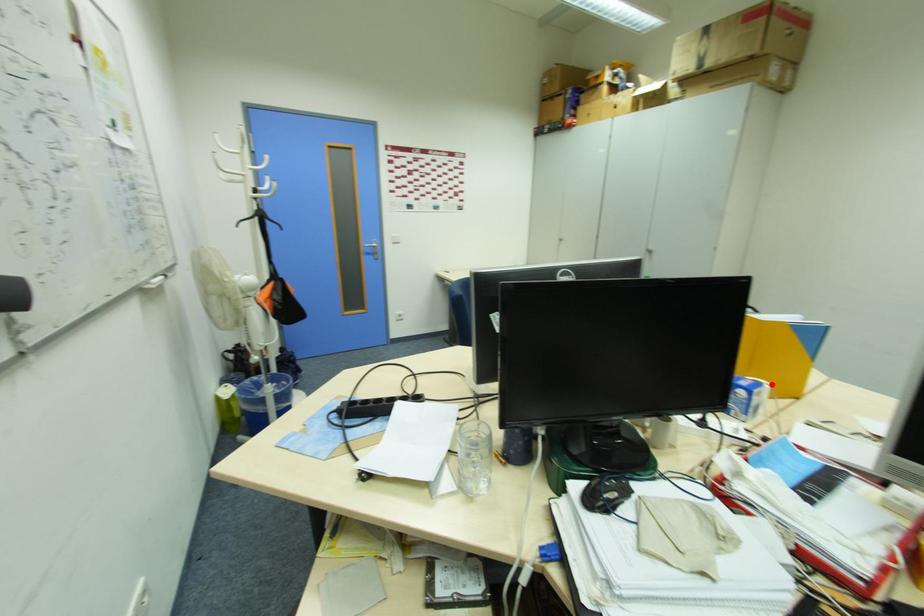
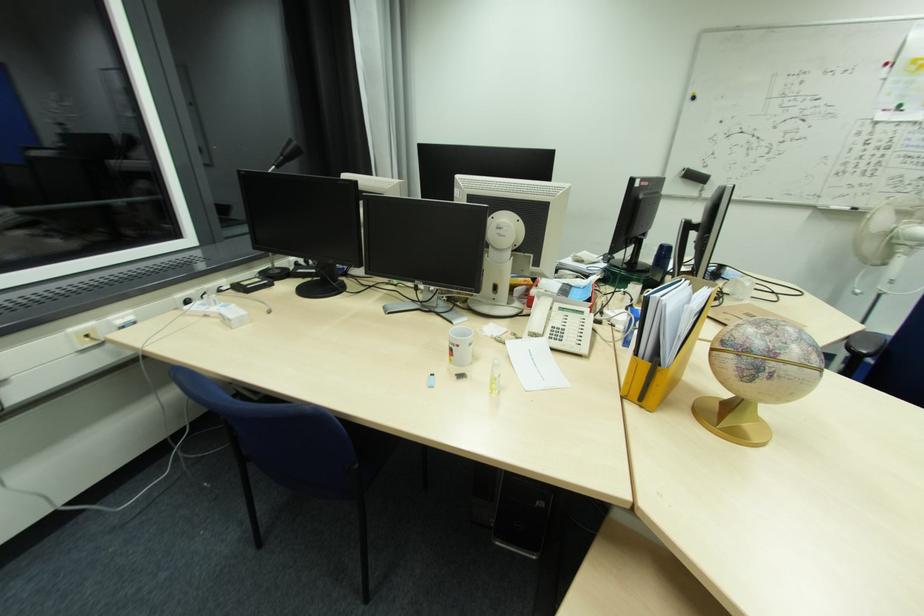
Question: I am providing you with two images of the same scene from different viewpoints. A red point is marked on the first image. Can you still see the location of the red point in image 2?

Choices:
 (A) Yes
 (B) No

Answer: (B)